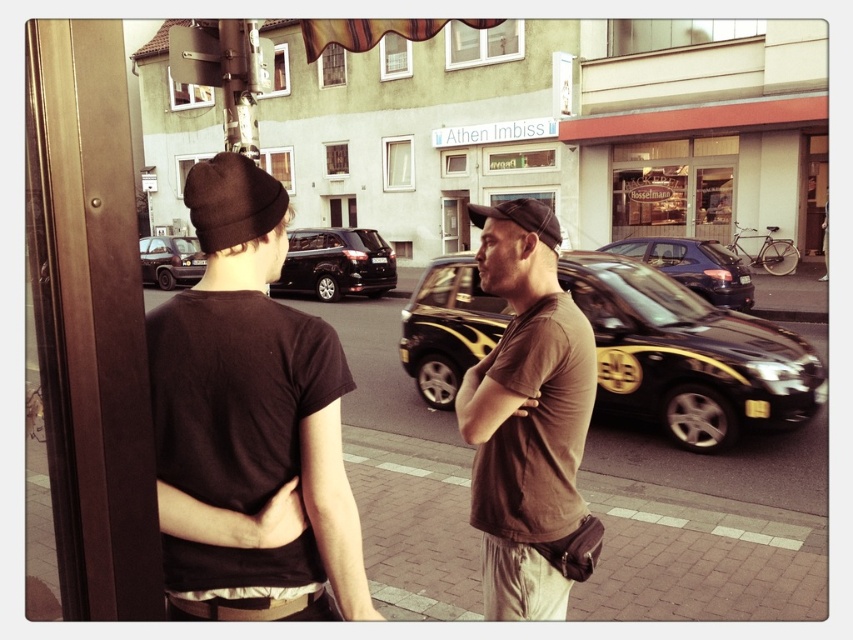
Can you confirm if black knit cap at upper left is positioned to the left of shiny black suv at center?

No, black knit cap at upper left is not to the left of shiny black suv at center.

Between black knit cap at upper left and shiny black suv at center, which one appears on the left side from the viewer's perspective?

shiny black suv at center

Describe the element at coordinates (231, 202) in the screenshot. This screenshot has width=853, height=640. I see `black knit cap at upper left` at that location.

At what (x,y) coordinates should I click in order to perform the action: click on black knit cap at upper left. Please return your answer as a coordinate pair (x, y). Looking at the image, I should click on (231, 202).

Does brown cotton shirt at center have a lesser width compared to black glossy taxi at center?

Yes.

What do you see at coordinates (529, 420) in the screenshot? This screenshot has width=853, height=640. I see `brown cotton shirt at center` at bounding box center [529, 420].

The height and width of the screenshot is (640, 853). What are the coordinates of `brown cotton shirt at center` in the screenshot? It's located at (529, 420).

Does dark brown cotton t-shirt at center have a smaller size compared to brown cotton shirt at center?

No.

From the picture: Is dark brown cotton t-shirt at center below brown cotton shirt at center?

Incorrect, dark brown cotton t-shirt at center is not positioned below brown cotton shirt at center.

Consider the image. Who is more forward, (260,214) or (587,348)?

Point (260,214) is in front.

You are a GUI agent. You are given a task and a screenshot of the screen. Output one action in this format:
    pyautogui.click(x=<x>, y=<y>)
    Task: Click on the dark brown cotton t-shirt at center
    Image resolution: width=853 pixels, height=640 pixels.
    Given the screenshot: What is the action you would take?
    (x=248, y=422)